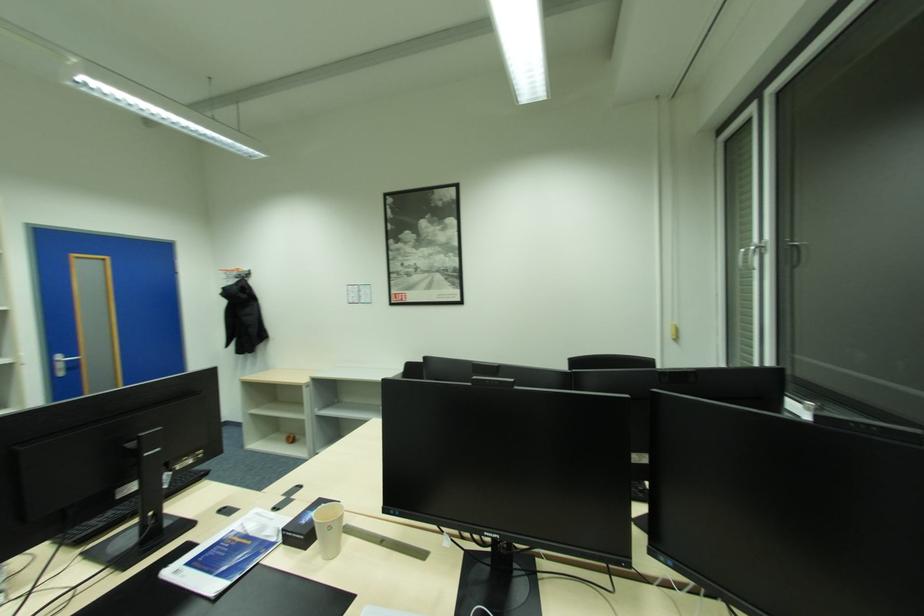
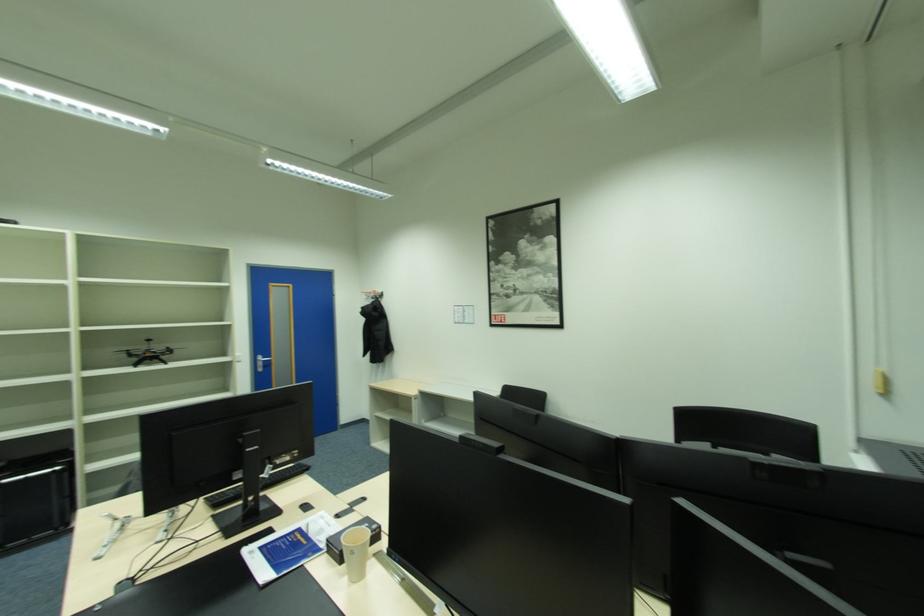
Question: The camera is either moving clockwise (left) or counter-clockwise (right) around the object. The first image is from the beginning of the video and the second image is from the end. Is the camera moving left or right when shooting the video?

Choices:
 (A) Left
 (B) Right

Answer: (B)